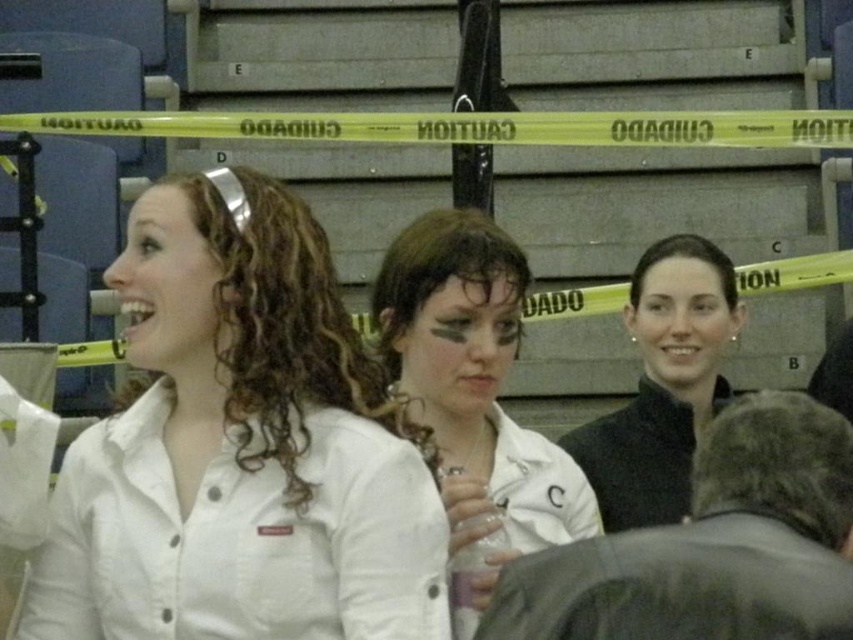
Question: Can you confirm if white matte shirt at upper left is positioned above white matte shirt at center?

Choices:
 (A) yes
 (B) no

Answer: (A)

Question: Estimate the real-world distances between objects in this image. Which object is closer to the white matte shirt at upper left?

Choices:
 (A) white matte shirt at center
 (B) black matte jacket at center

Answer: (A)

Question: Which object is farther from the camera taking this photo?

Choices:
 (A) white matte shirt at upper left
 (B) white matte shirt at center

Answer: (B)

Question: Does white matte shirt at upper left have a lesser width compared to white matte shirt at center?

Choices:
 (A) yes
 (B) no

Answer: (B)

Question: Which point is closer to the camera taking this photo?

Choices:
 (A) (438, 336)
 (B) (624, 307)

Answer: (A)

Question: Is white matte shirt at upper left above black matte jacket at center?

Choices:
 (A) no
 (B) yes

Answer: (B)